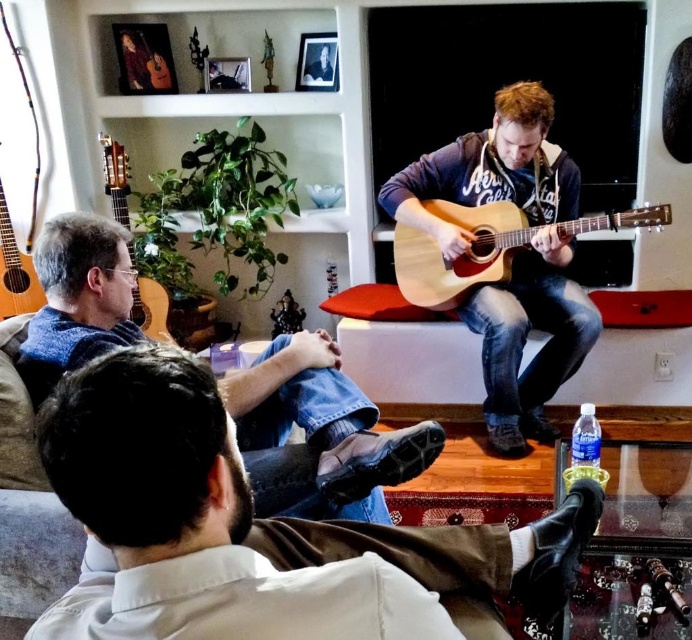
Question: Which point is closer to the camera?

Choices:
 (A) (19, 257)
 (B) (163, 314)
 (C) (480, 241)
 (D) (271, 541)

Answer: (D)

Question: Does brown leather jacket at lower center appear under natural wood acoustic guitar at center?

Choices:
 (A) yes
 (B) no

Answer: (A)

Question: Can you confirm if blue denim jeans at lower left is bigger than natural wood acoustic guitar at center?

Choices:
 (A) yes
 (B) no

Answer: (B)

Question: Estimate the real-world distances between objects in this image. Which object is farther from the brown leather jacket at lower center?

Choices:
 (A) light brown wood acoustic guitar at left
 (B) light brown wood guitar at left
 (C) natural wood acoustic guitar at center
 (D) blue denim jeans at lower left

Answer: (A)

Question: Is blue denim jeans at lower left behind natural wood acoustic guitar at center?

Choices:
 (A) no
 (B) yes

Answer: (A)

Question: Which of the following is the closest to the observer?

Choices:
 (A) light brown wood acoustic guitar at left
 (B) blue denim jeans at lower left

Answer: (B)